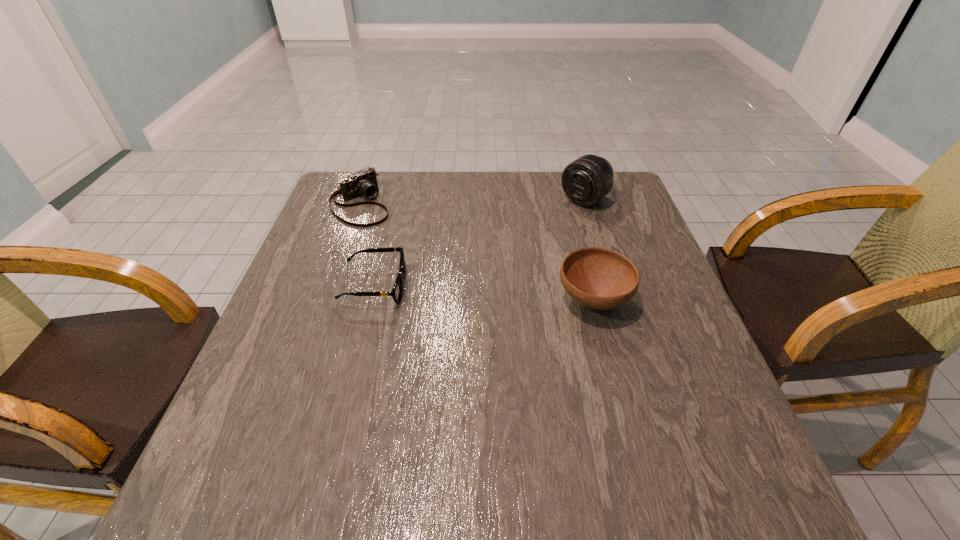
The height and width of the screenshot is (540, 960). I want to click on vacant area that satisfies the following two spatial constraints: 1. on the front side of the shortest object; 2. on the front-facing side of the camera, so click(331, 286).